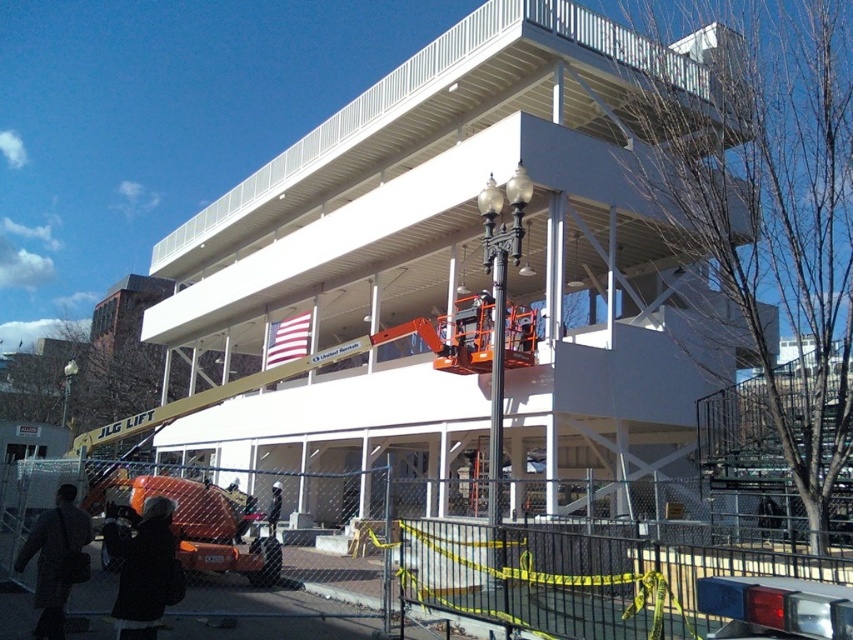
Question: Which object appears closest to the camera in this image?

Choices:
 (A) dark gray coat at lower left
 (B) black wool coat at lower left
 (C) black fabric jacket at center

Answer: (B)

Question: Considering the real-world distances, which object is farthest from the black wool coat at lower left?

Choices:
 (A) black fabric jacket at center
 (B) dark gray coat at lower left

Answer: (A)

Question: Based on their relative distances, which object is nearer to the black fabric jacket at center?

Choices:
 (A) black wool coat at lower left
 (B) dark gray coat at lower left

Answer: (B)

Question: Is dark gray coat at lower left positioned behind black fabric jacket at center?

Choices:
 (A) yes
 (B) no

Answer: (B)

Question: Can you confirm if dark gray coat at lower left is positioned to the right of black fabric jacket at center?

Choices:
 (A) no
 (B) yes

Answer: (B)

Question: Does black wool coat at lower left have a smaller size compared to black fabric jacket at center?

Choices:
 (A) no
 (B) yes

Answer: (A)